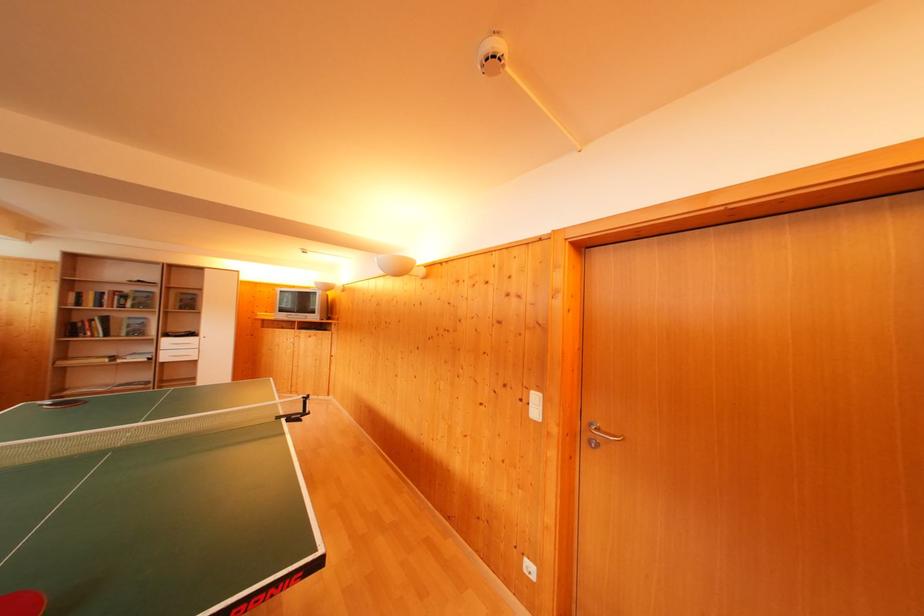
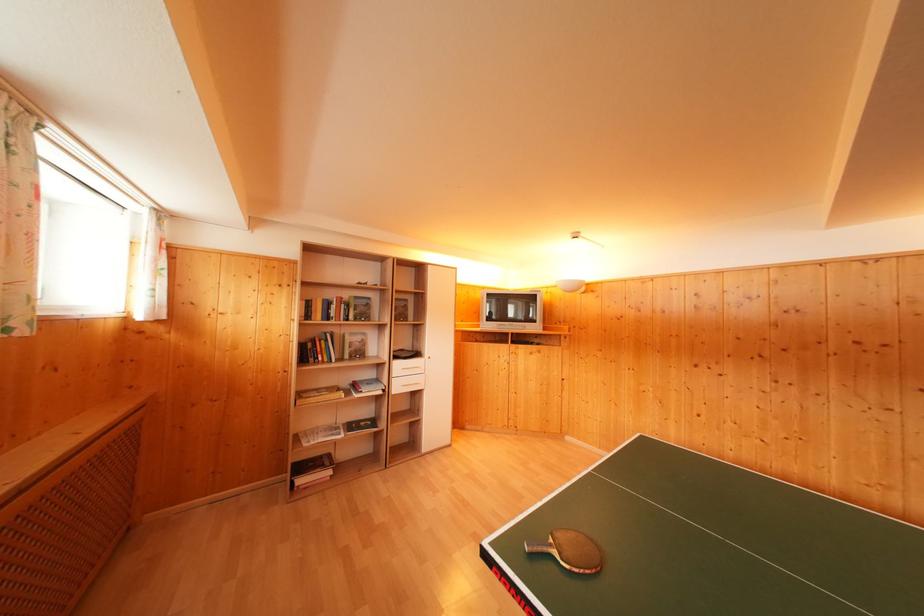
The point at (167,352) is marked in the first image. Where is the corresponding point in the second image?

(398, 379)